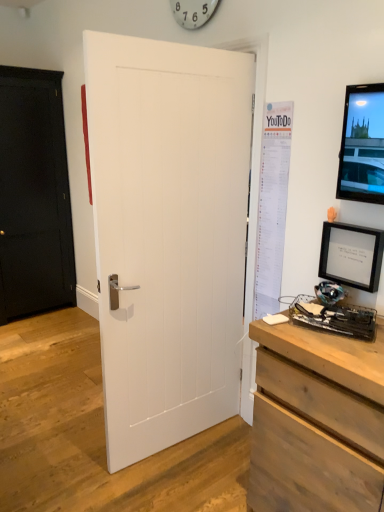
Question: From a real-world perspective, relative to black matte picture frame at right, is white matte door at center, the 1th door in the front-to-back sequence, vertically above or below?

Choices:
 (A) below
 (B) above

Answer: (A)

Question: From the image's perspective, relative to black matte picture frame at right, is white matte door at center, arranged as the first door when viewed from the right, above or below?

Choices:
 (A) below
 (B) above

Answer: (A)

Question: Which object is positioned closest to the wooden chest of drawers at lower right?

Choices:
 (A) white paper poster at right
 (B) metallic black desktop computer at lower right
 (C) white matte notepad at center
 (D) black matte door at left, the 1th door in the left-to-right sequence
 (E) black matte picture frame at right

Answer: (B)

Question: Which object is the closest to the black matte door at left, the 1th door in the left-to-right sequence?

Choices:
 (A) black matte picture frame at right
 (B) wooden chest of drawers at lower right
 (C) white matte door at center, the 1th door in the front-to-back sequence
 (D) white plastic clock at upper center
 (E) white matte notepad at center

Answer: (D)